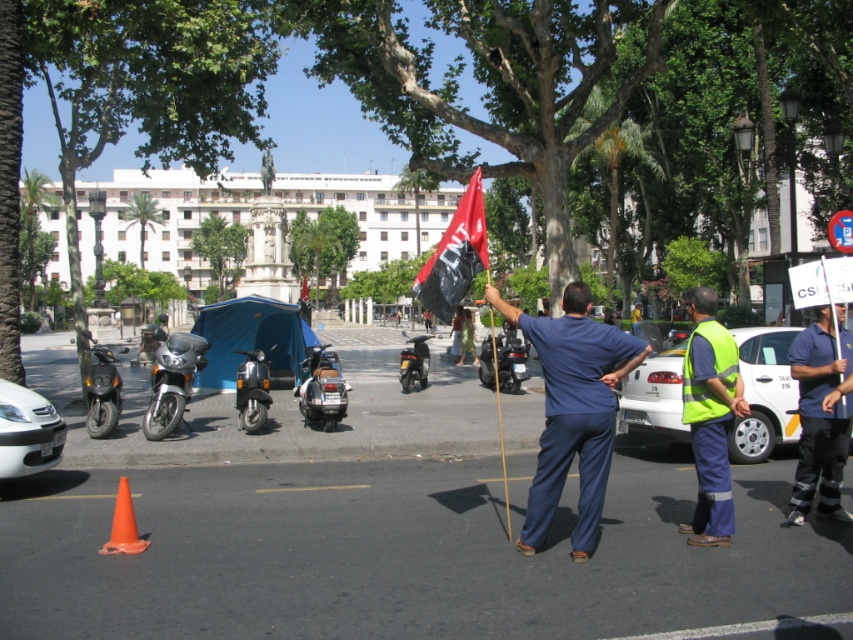
Question: Which point appears closest to the camera in this image?

Choices:
 (A) (112, 531)
 (B) (837, 305)
 (C) (596, 349)
 (D) (509, 390)

Answer: (C)

Question: Can you confirm if high visibility fabric vest at right is positioned above metallic silver motorcycle at center?

Choices:
 (A) no
 (B) yes

Answer: (A)

Question: Which point is farther to the camera?

Choices:
 (A) metallic silver scooter at center
 (B) orange matte cone at lower left
 (C) shiny chrome scooter at center
 (D) reflective blue shirt at center

Answer: (A)

Question: Which object appears closest to the camera in this image?

Choices:
 (A) silver metallic motorcycle at left
 (B) metallic silver motorcycle at center
 (C) orange matte cone at lower left
 (D) shiny chrome scooter at center

Answer: (C)

Question: Is blue fabric pants at center to the left of shiny chrome scooter at center from the viewer's perspective?

Choices:
 (A) no
 (B) yes

Answer: (A)

Question: Can you confirm if reflective blue shirt at center is bigger than shiny metallic scooter at left?

Choices:
 (A) yes
 (B) no

Answer: (B)